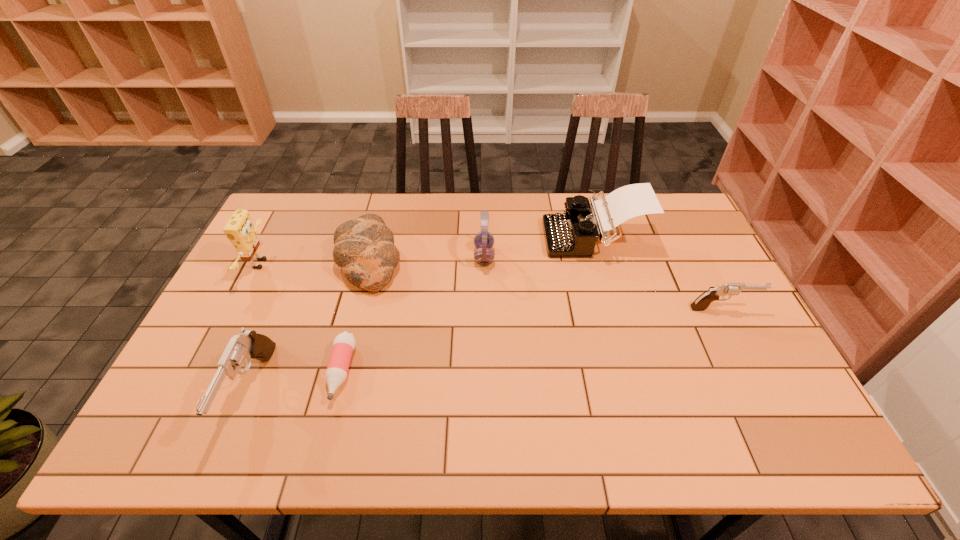
In order to click on free space located 0.340m on the keys of the typewriter in this screenshot , I will do `click(441, 237)`.

Find the location of `vacant space situated on the keys of the typewriter`. vacant space situated on the keys of the typewriter is located at coordinates (474, 237).

Find the location of a particular element. This screenshot has width=960, height=540. vacant area located on the headband and ear cups of the third object from right to left is located at coordinates (395, 256).

This screenshot has width=960, height=540. Find the location of `free point located on the headband and ear cups of the third object from right to left`. free point located on the headband and ear cups of the third object from right to left is located at coordinates (458, 256).

Find the location of a particular element. vacant area located on the headband and ear cups of the third object from right to left is located at coordinates (369, 256).

The width and height of the screenshot is (960, 540). In order to click on free space located on the back of the bread in this screenshot , I will do `click(381, 210)`.

I want to click on vacant space located 0.250m on the face of the leftmost object, so 352,264.

The image size is (960, 540). In order to click on typewriter that is at the far edge in this screenshot , I will do `click(574, 233)`.

Where is `bread at the far edge`? bread at the far edge is located at coordinates (x=364, y=248).

The width and height of the screenshot is (960, 540). I want to click on gun that is at the near edge, so click(248, 344).